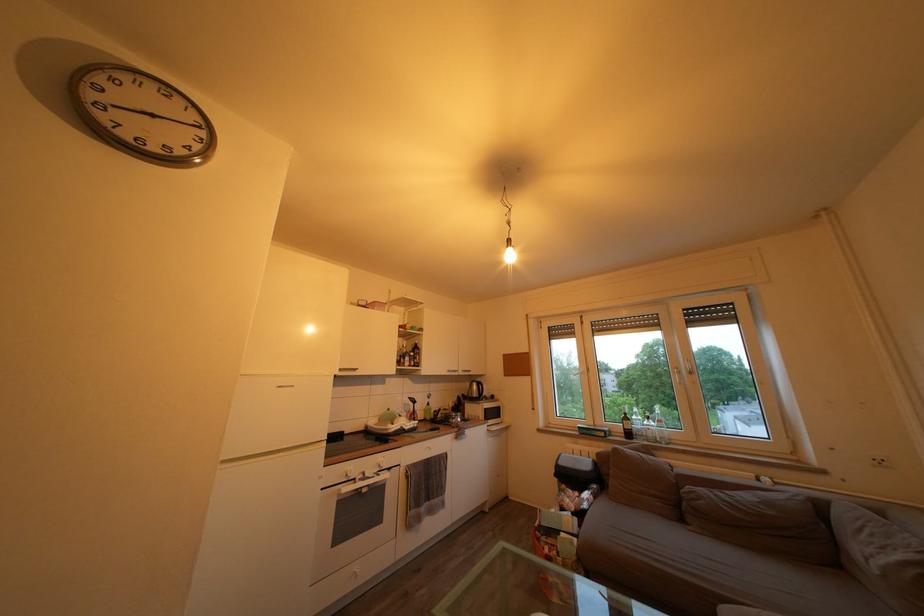
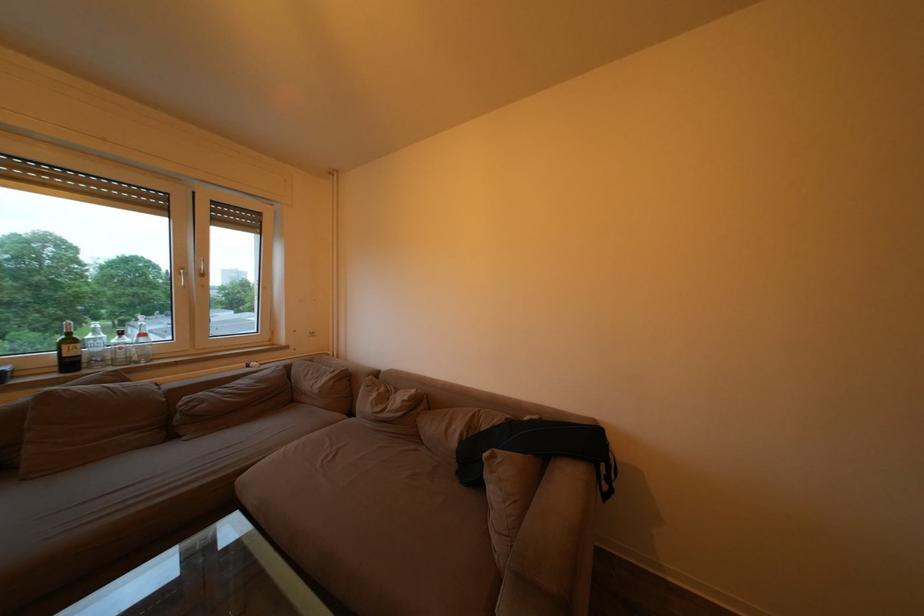
Find the pixel in the second image that matches pixel 635 424 in the first image.

(79, 347)